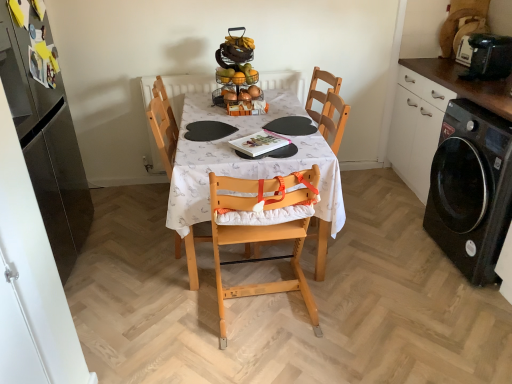
This screenshot has width=512, height=384. I want to click on vacant region to the left of light wood highchair at center, the first chair viewed from the right, so click(x=178, y=308).